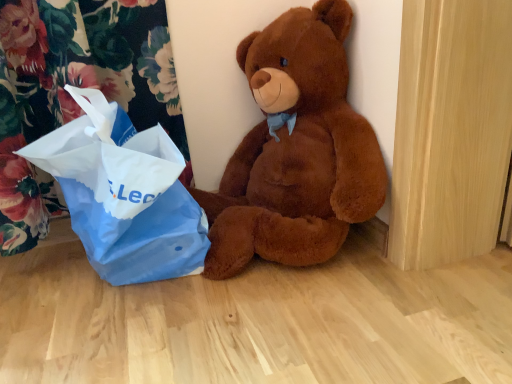
Question: From the image's perspective, is brown plush teddy bear at center on top of blue paper bag at left?

Choices:
 (A) yes
 (B) no

Answer: (A)

Question: From a real-world perspective, does brown plush teddy bear at center stand above blue paper bag at left?

Choices:
 (A) yes
 (B) no

Answer: (A)

Question: Can you confirm if brown plush teddy bear at center is taller than blue paper bag at left?

Choices:
 (A) no
 (B) yes

Answer: (B)

Question: Is brown plush teddy bear at center thinner than blue paper bag at left?

Choices:
 (A) yes
 (B) no

Answer: (B)

Question: Is brown plush teddy bear at center smaller than blue paper bag at left?

Choices:
 (A) yes
 (B) no

Answer: (B)

Question: From the image's perspective, would you say brown plush teddy bear at center is shown under blue paper bag at left?

Choices:
 (A) yes
 (B) no

Answer: (B)

Question: Does blue paper bag at left have a larger size compared to brown plush teddy bear at center?

Choices:
 (A) yes
 (B) no

Answer: (B)

Question: Is the position of blue paper bag at left less distant than that of brown plush teddy bear at center?

Choices:
 (A) yes
 (B) no

Answer: (B)

Question: Can you confirm if blue paper bag at left is thinner than brown plush teddy bear at center?

Choices:
 (A) yes
 (B) no

Answer: (A)

Question: Is blue paper bag at left looking in the opposite direction of brown plush teddy bear at center?

Choices:
 (A) yes
 (B) no

Answer: (B)

Question: Can we say blue paper bag at left lies outside brown plush teddy bear at center?

Choices:
 (A) no
 (B) yes

Answer: (B)

Question: Is the depth of blue paper bag at left greater than that of brown plush teddy bear at center?

Choices:
 (A) yes
 (B) no

Answer: (A)

Question: From the image's perspective, is blue paper bag at left positioned above or below brown plush teddy bear at center?

Choices:
 (A) above
 (B) below

Answer: (B)